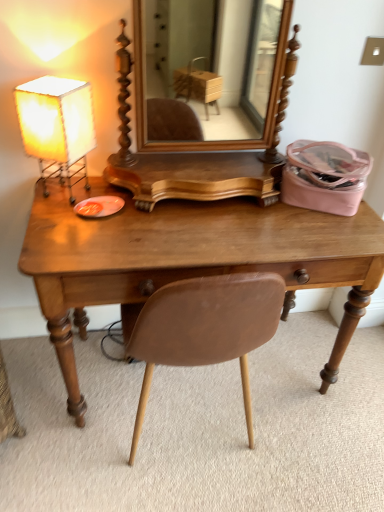
The height and width of the screenshot is (512, 384). I want to click on spots to the right of matte white lampshade at left, so click(125, 205).